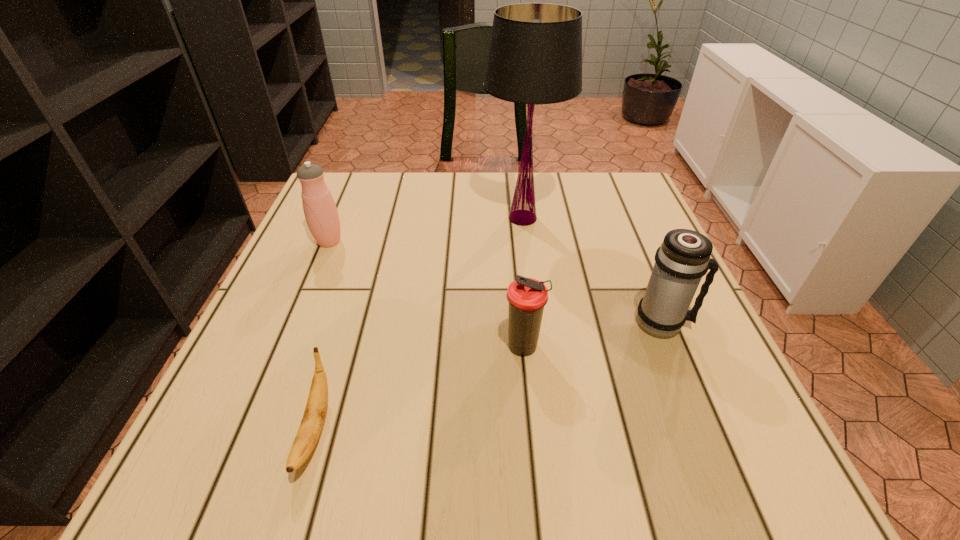
Locate an element on the screen. The image size is (960, 540). the tallest object is located at coordinates (535, 55).

You are a GUI agent. You are given a task and a screenshot of the screen. Output one action in this format:
    pyautogui.click(x=<x>, y=<y>)
    Task: Click on the leftmost object
    The image size is (960, 540).
    Given the screenshot: What is the action you would take?
    pyautogui.click(x=320, y=210)

Where is `the leftmost thermos bottle`? This screenshot has height=540, width=960. the leftmost thermos bottle is located at coordinates (320, 210).

The height and width of the screenshot is (540, 960). Find the location of `the rightmost thermos bottle`. the rightmost thermos bottle is located at coordinates (683, 258).

You are a GUI agent. You are given a task and a screenshot of the screen. Output one action in this format:
    pyautogui.click(x=<x>, y=<y>)
    Task: Click on the second thermos bottle from right to left
    The image size is (960, 540).
    Given the screenshot: What is the action you would take?
    pyautogui.click(x=527, y=297)

At what (x,y) coordinates should I click in order to perform the action: click on the fourth tallest object. Please return your answer as a coordinate pair (x, y). The height and width of the screenshot is (540, 960). Looking at the image, I should click on (527, 297).

Find the location of a particular element. the nearest object is located at coordinates (311, 425).

In order to click on the fourth object from right to left in this screenshot , I will do `click(311, 425)`.

Locate an element on the screen. The image size is (960, 540). free location located 0.130m on the front-facing side of the lampshade is located at coordinates (432, 218).

The image size is (960, 540). I want to click on free spot located 0.180m on the front-facing side of the lampshade, so click(x=412, y=218).